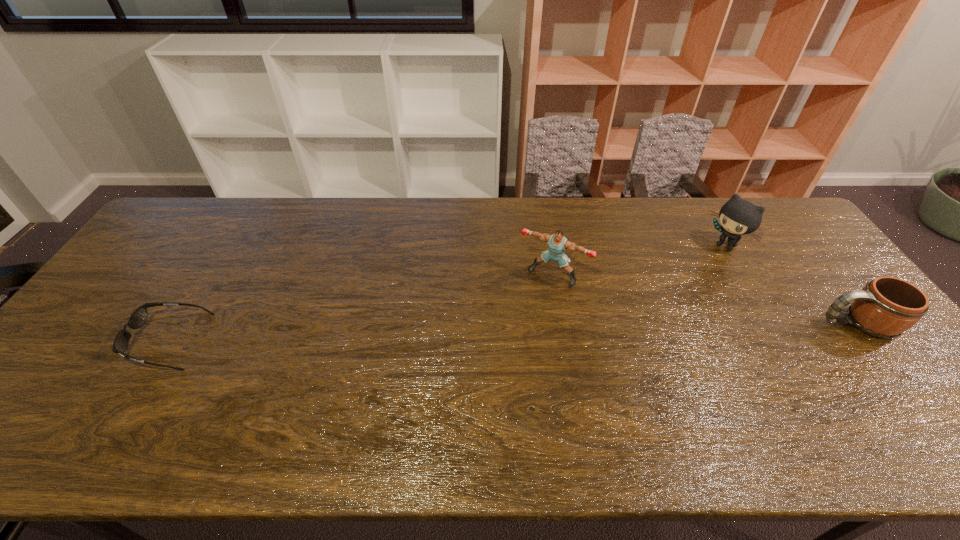
Locate an element on the screen. This screenshot has height=540, width=960. vacant region that satisfies the following two spatial constraints: 1. on the front side of the kitten; 2. on the side of the mug with the handle is located at coordinates (771, 323).

Identify the location of vacant area in the image that satisfies the following two spatial constraints: 1. on the front side of the farthest object; 2. on the side of the rightmost object with the handle. The height and width of the screenshot is (540, 960). (771, 323).